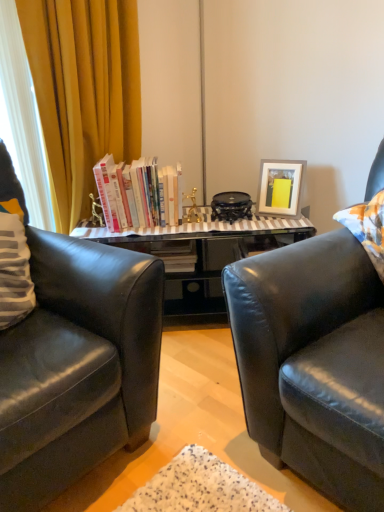
Question: From the image's perspective, is black leather chair at left on top of matte gray picture frame at upper right?

Choices:
 (A) no
 (B) yes

Answer: (A)

Question: Considering the relative sizes of black leather chair at left and matte gray picture frame at upper right in the image provided, is black leather chair at left taller than matte gray picture frame at upper right?

Choices:
 (A) yes
 (B) no

Answer: (A)

Question: Considering the relative sizes of black leather chair at left and matte gray picture frame at upper right in the image provided, is black leather chair at left thinner than matte gray picture frame at upper right?

Choices:
 (A) no
 (B) yes

Answer: (A)

Question: Is black leather chair at left bigger than matte gray picture frame at upper right?

Choices:
 (A) no
 (B) yes

Answer: (B)

Question: Does black leather chair at left have a lesser height compared to matte gray picture frame at upper right?

Choices:
 (A) yes
 (B) no

Answer: (B)

Question: Does black leather chair at left appear on the right side of matte gray picture frame at upper right?

Choices:
 (A) yes
 (B) no

Answer: (B)

Question: Considering the relative sizes of black leather chair at left and yellow fabric curtain at left in the image provided, is black leather chair at left smaller than yellow fabric curtain at left?

Choices:
 (A) no
 (B) yes

Answer: (A)

Question: Could you tell me if black leather chair at left is turned towards yellow fabric curtain at left?

Choices:
 (A) no
 (B) yes

Answer: (A)

Question: Does black leather chair at left come in front of yellow fabric curtain at left?

Choices:
 (A) yes
 (B) no

Answer: (A)

Question: Is yellow fabric curtain at left completely or partially inside black leather chair at left?

Choices:
 (A) yes
 (B) no

Answer: (B)

Question: Does black leather chair at left have a lesser height compared to yellow fabric curtain at left?

Choices:
 (A) no
 (B) yes

Answer: (B)

Question: From the image's perspective, does black leather chair at left appear higher than yellow fabric curtain at left?

Choices:
 (A) yes
 (B) no

Answer: (B)

Question: Does black leather chair at left have a greater height compared to hardcover books at center?

Choices:
 (A) no
 (B) yes

Answer: (B)